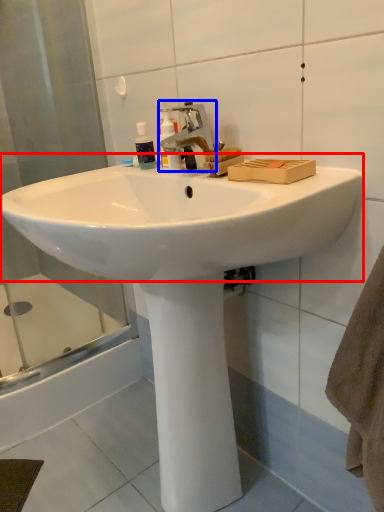
Question: Which object appears farthest to the camera in this image, sink (highlighted by a red box) or tap (highlighted by a blue box)?

Choices:
 (A) sink
 (B) tap

Answer: (B)